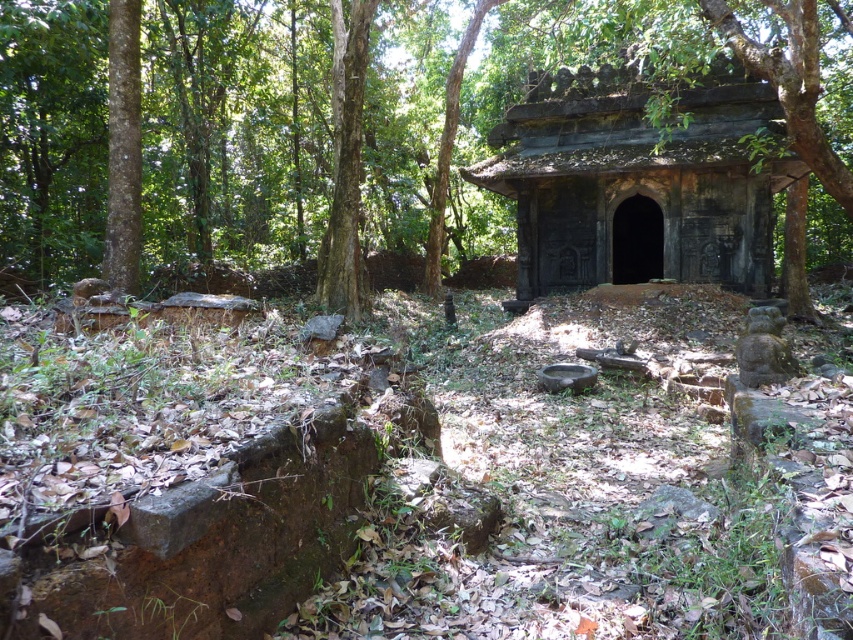
Question: Does brown rough tree at center appear on the right side of dark gray stone hut at center?

Choices:
 (A) yes
 (B) no

Answer: (B)

Question: Which point appears farthest from the camera in this image?

Choices:
 (A) (711, 84)
 (B) (35, 80)

Answer: (A)

Question: Can you confirm if brown rough tree at center is smaller than dark gray stone hut at center?

Choices:
 (A) no
 (B) yes

Answer: (A)

Question: Can you confirm if brown rough tree at center is positioned to the right of dark gray stone hut at center?

Choices:
 (A) no
 (B) yes

Answer: (A)